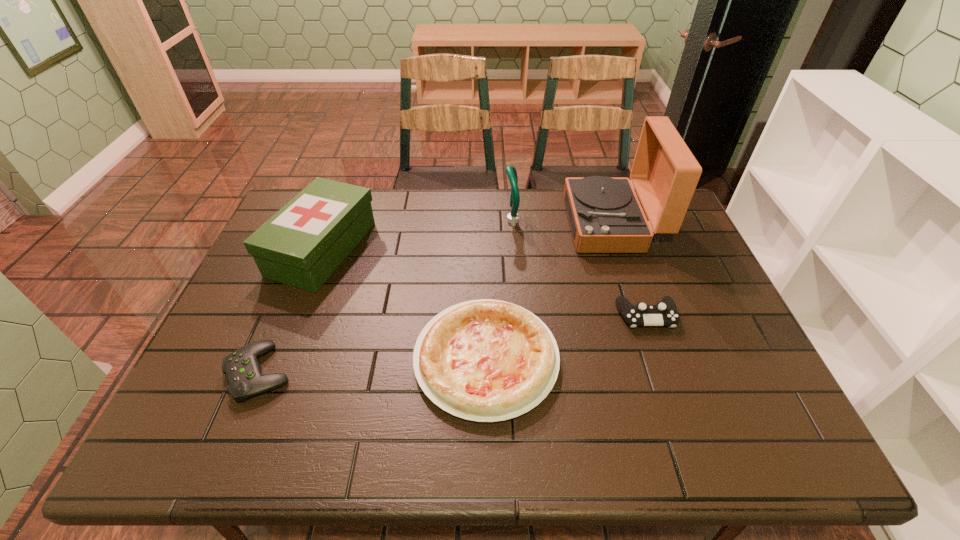
The image size is (960, 540). In the image, there is a desktop. Find the location of `vacant space at the left edge`. vacant space at the left edge is located at coordinates (289, 287).

Locate an element on the screen. vacant region at the right edge of the desktop is located at coordinates (712, 306).

Where is `vacant area that lies between the fourth shortest object and the pizza`? This screenshot has height=540, width=960. vacant area that lies between the fourth shortest object and the pizza is located at coordinates (404, 304).

Locate an element on the screen. This screenshot has width=960, height=540. free space between the right control and the first-aid kit is located at coordinates (485, 282).

This screenshot has height=540, width=960. Find the location of `free spot between the fourth shortest object and the bottle opener`. free spot between the fourth shortest object and the bottle opener is located at coordinates (417, 235).

The image size is (960, 540). Find the location of `free spot between the right control and the first-aid kit`. free spot between the right control and the first-aid kit is located at coordinates (485, 282).

Locate an element on the screen. The height and width of the screenshot is (540, 960). blank region between the pizza and the tallest object is located at coordinates (549, 291).

What are the coordinates of `vacant area that lies between the nearer control and the second tallest object` in the screenshot? It's located at (385, 296).

You are a GUI agent. You are given a task and a screenshot of the screen. Output one action in this format:
    pyautogui.click(x=<x>, y=<y>)
    Task: Click on the free space between the nearer control and the pizza
    Image resolution: width=960 pixels, height=540 pixels.
    Given the screenshot: What is the action you would take?
    pyautogui.click(x=372, y=366)

This screenshot has width=960, height=540. Find the location of `free space between the pizza and the second tallest object`. free space between the pizza and the second tallest object is located at coordinates (498, 290).